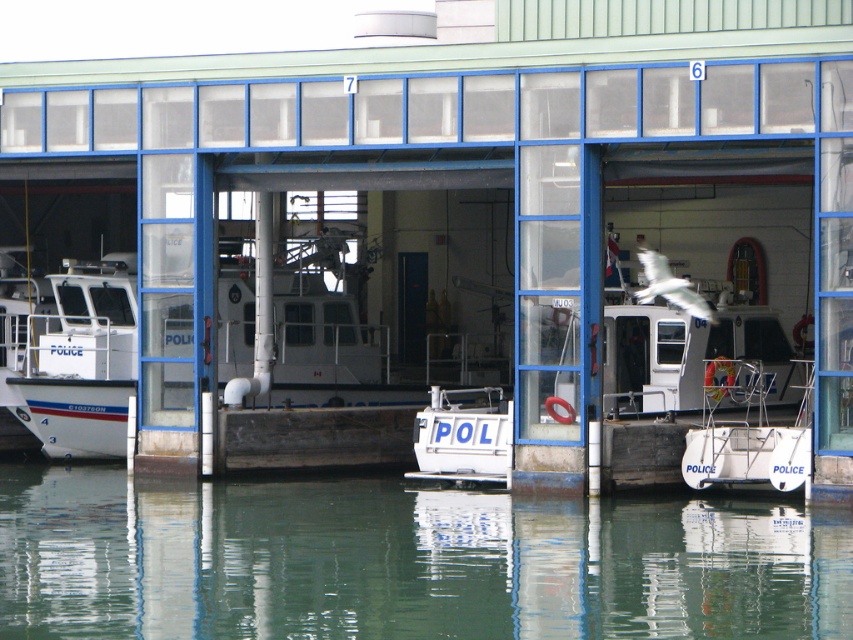
Can you confirm if green reflective water at lower center is positioned to the left of white matte police boat at left?

No, green reflective water at lower center is not to the left of white matte police boat at left.

Does point (149, 600) come farther from viewer compared to point (51, 404)?

No, it is not.

This screenshot has width=853, height=640. I want to click on green reflective water at lower center, so click(x=404, y=563).

Consider the image. Who is higher up, white matte police boat at left or white matte/polished boat at center?

white matte police boat at left is above.

Where is `white matte police boat at left`? white matte police boat at left is located at coordinates (74, 358).

Is green reflective water at lower center closer to camera compared to white plastic boat at lower right?

Yes, green reflective water at lower center is in front of white plastic boat at lower right.

From the picture: Who is positioned more to the left, green reflective water at lower center or white plastic boat at lower right?

green reflective water at lower center is more to the left.

Does point (670, 636) come closer to viewer compared to point (717, 392)?

Yes, point (670, 636) is in front of point (717, 392).

In order to click on green reflective water at lower center in this screenshot , I will do `click(404, 563)`.